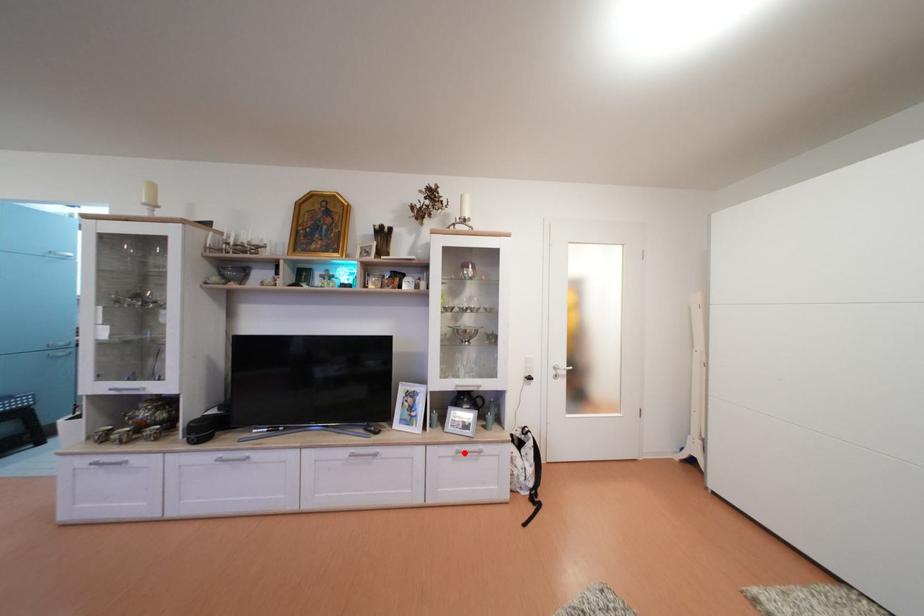
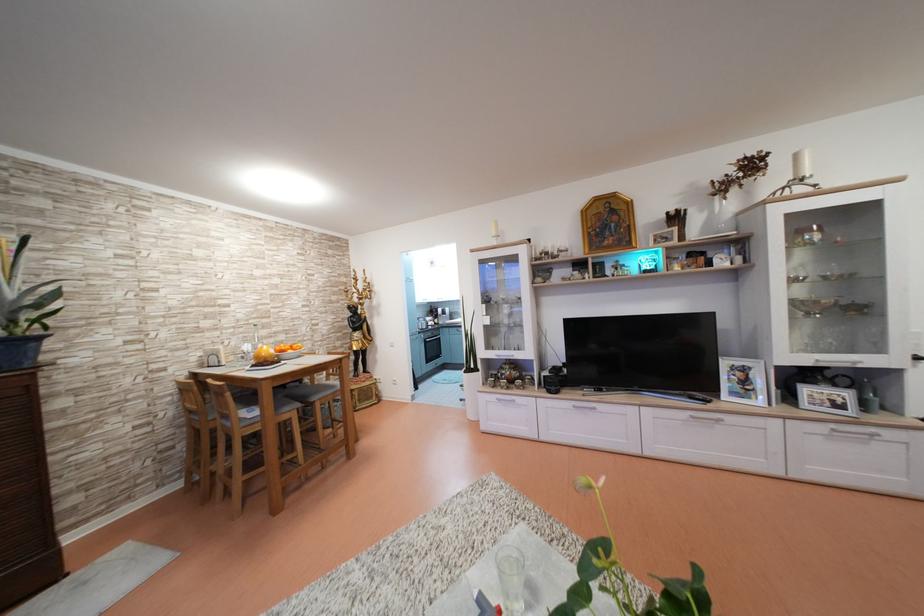
Locate, in the second image, the point that corresponds to the highlighted location in the first image.

(840, 431)